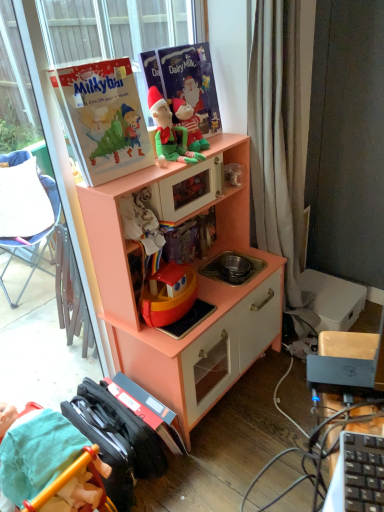
Where is `free location to the right of green plush toy at upper center, which is counted as the second person, starting from the left`? Image resolution: width=384 pixels, height=512 pixels. free location to the right of green plush toy at upper center, which is counted as the second person, starting from the left is located at coordinates (217, 142).